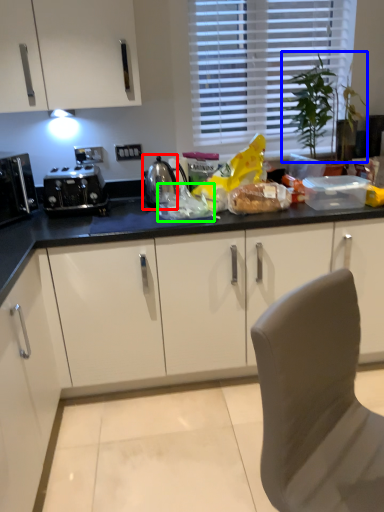
Question: Estimate the real-world distances between objects in this image. Which object is closer to appliance (highlighted by a red box), plant (highlighted by a blue box) or food (highlighted by a green box)?

Choices:
 (A) plant
 (B) food

Answer: (B)